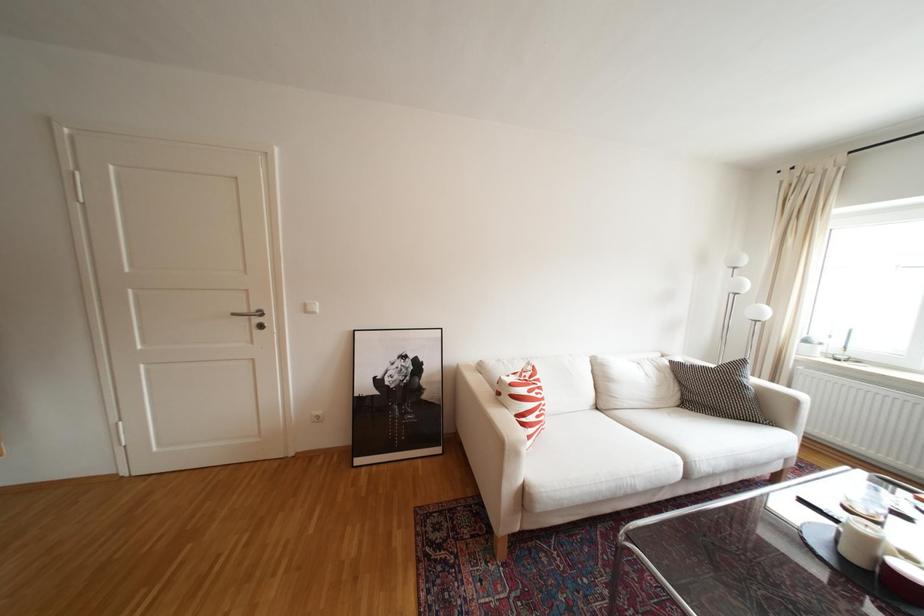
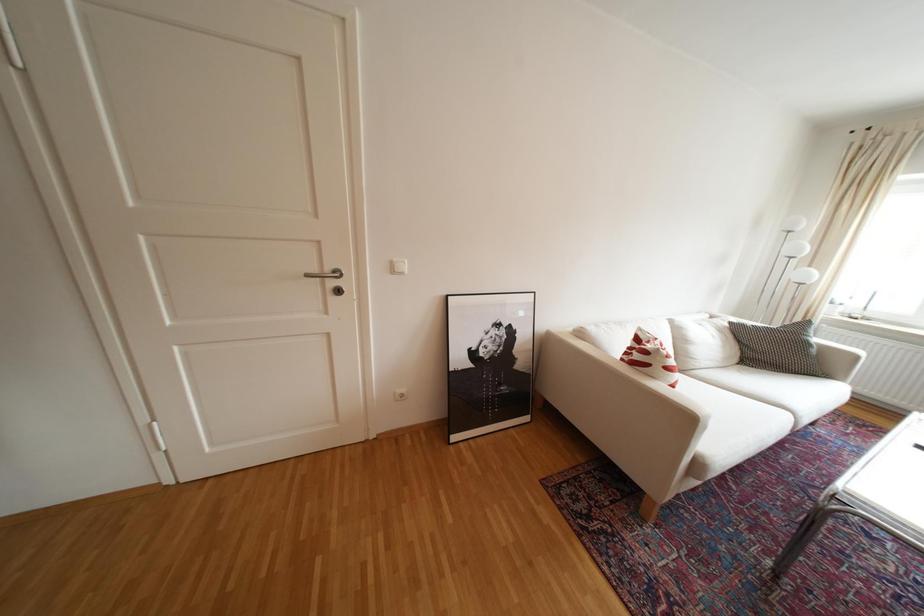
In a continuous first-person perspective shot, in which direction is the camera moving?

The movement direction of the cameraman is left, forward.